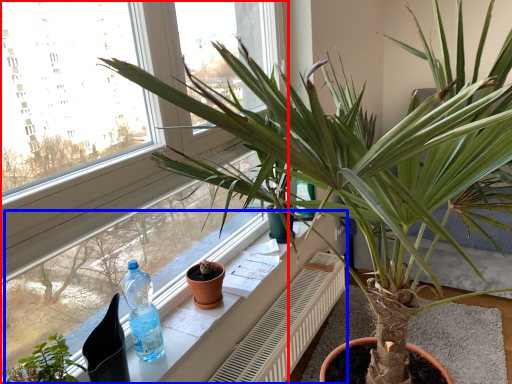
Question: Which point is closer to the camera, window (highlighted by a red box) or window sill (highlighted by a blue box)?

Choices:
 (A) window
 (B) window sill

Answer: (A)